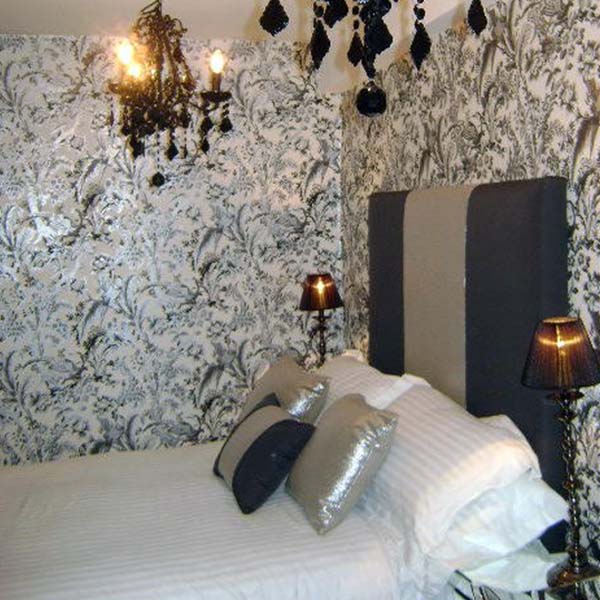
Image resolution: width=600 pixels, height=600 pixels. What are the coordinates of `pillow` in the screenshot? It's located at (470, 530).